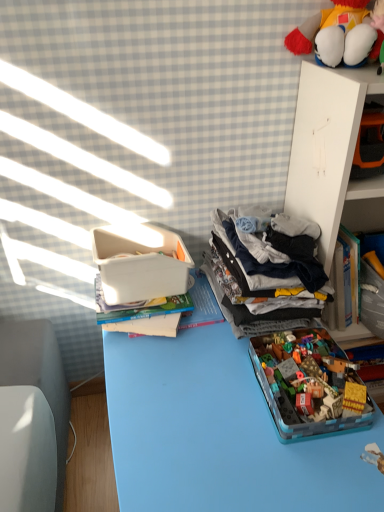
At what (x,y) coordinates should I click in order to perform the action: click on free space above white plastic container at upper left (from a real-world perspective). Please return your answer as a coordinate pair (x, y). Looking at the image, I should click on (215, 390).